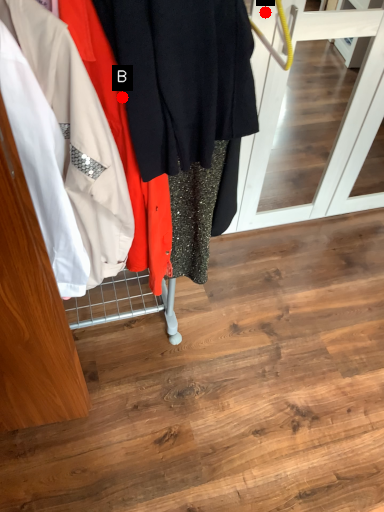
Question: Two points are circled on the image, labeled by A and B beside each circle. Which point is closer to the camera taking this photo?

Choices:
 (A) A is closer
 (B) B is closer

Answer: (B)